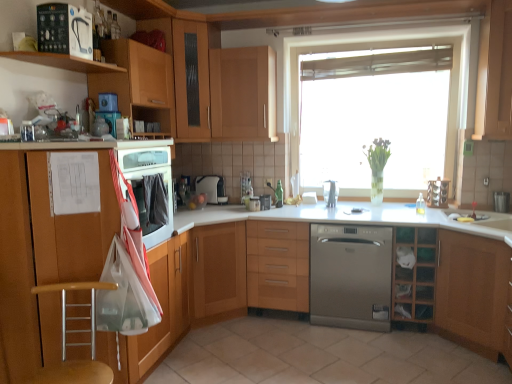
This screenshot has width=512, height=384. What are the coordinates of `vacant area located to the right-hand side of metallic silver toaster at center, positioned as the 1th appliance in left-to-right order` in the screenshot? It's located at (275, 211).